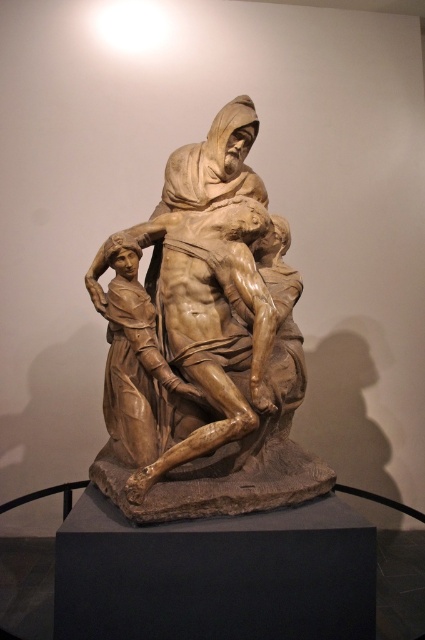
You are an art curator examining the wooden sculpture of man at center and the brown wood statue at center. Which one has a greater height?

The wooden sculpture of man at center is taller than the brown wood statue at center.

You are standing in a museum and want to take a photo of the brown wood sculpture at center. The museum requires visitors to stand exactly at the coordinates point (x=206, y=346) to take the perfect shot. Are you currently at the correct position to capture the sculpture perfectly?

The brown wood sculpture at center is located at point (x=206, y=346), so if you are standing exactly at those coordinates, you are at the correct position to capture the sculpture perfectly.

You are an art curator planning to install a protective glass case around the wooden sculpture of man at center and the brown wood statue at center. The glass case has a height limit of 2 meters. Can both sculptures fit inside the case without any modifications?

The wooden sculpture of man at center is larger in size than brown wood statue at center. However, since the exact dimensions of both sculptures are not provided, it is uncertain whether they can fit within the 2 meter height limit. Additional measurements are needed to confirm.